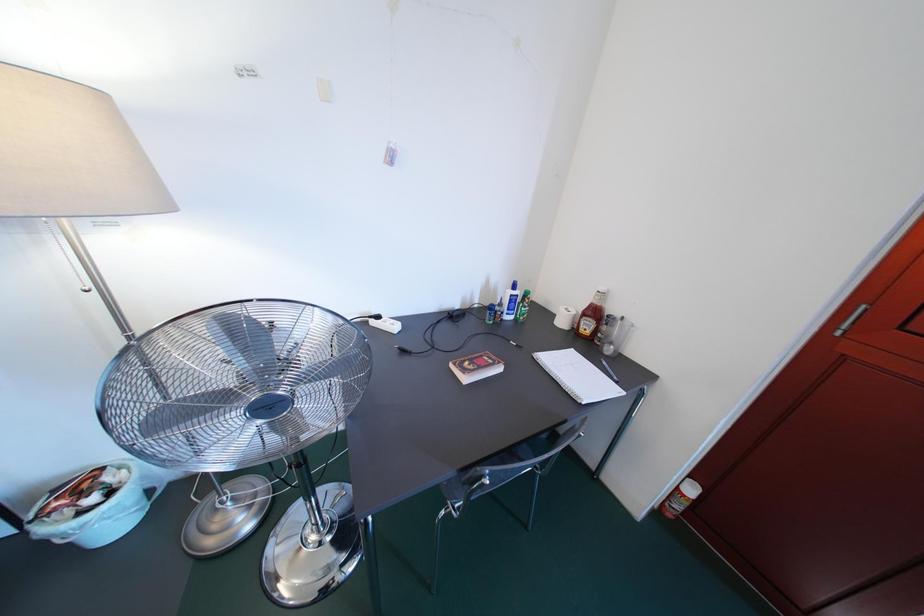
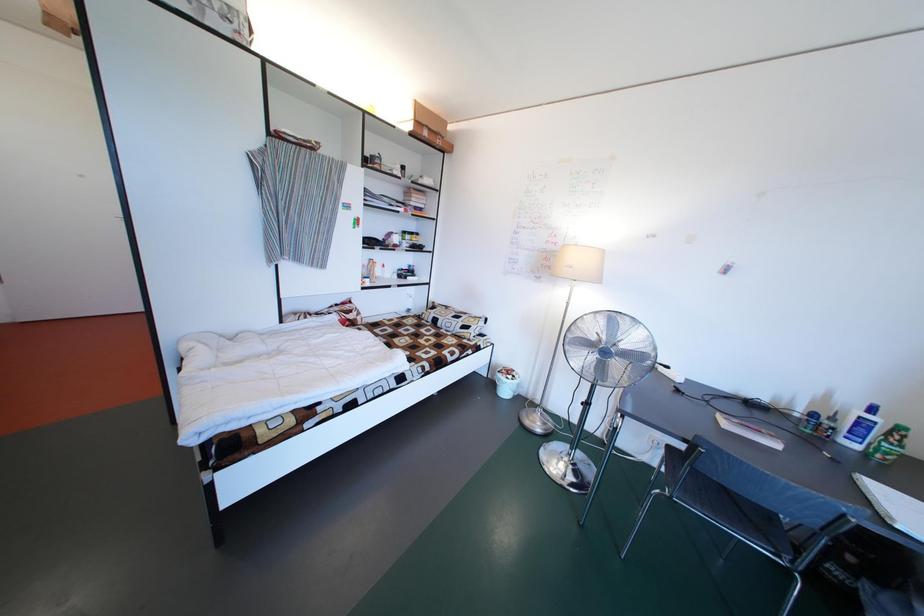
Question: How did the camera likely rotate?

Choices:
 (A) Left
 (B) Right
 (C) Up
 (D) Down

Answer: (A)